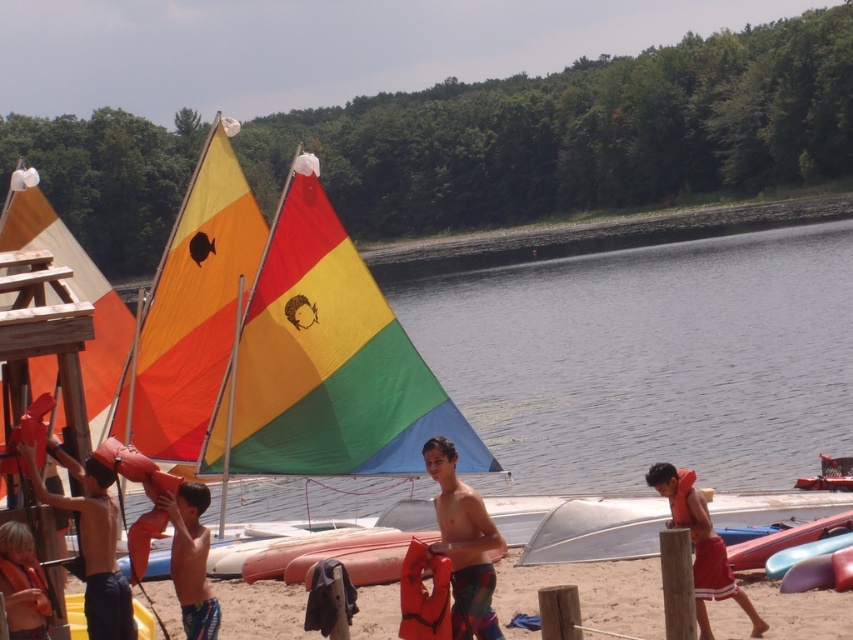
Which is in front, point (47, 444) or point (30, 580)?

Point (30, 580)

Does point (45, 502) come closer to viewer compared to point (22, 582)?

That is False.

In order to click on orange life vest at left in this screenshot , I will do `click(91, 541)`.

Can you confirm if orange life vest at center is taller than orange matte life jacket at center?

Correct, orange life vest at center is much taller as orange matte life jacket at center.

Is point (218, 621) positioned after point (398, 634)?

No.

Where is `orange life vest at center`? The image size is (853, 640). orange life vest at center is located at coordinates (190, 560).

Can you confirm if red life vest at right is thinner than orange matte life jacket at right?

In fact, red life vest at right might be wider than orange matte life jacket at right.

Which is more to the left, red life vest at right or orange matte life jacket at right?

Positioned to the left is orange matte life jacket at right.

Which is in front, point (753, 616) or point (682, 486)?

Positioned in front is point (682, 486).

Find the location of a particular element. This screenshot has height=640, width=853. red life vest at right is located at coordinates (701, 545).